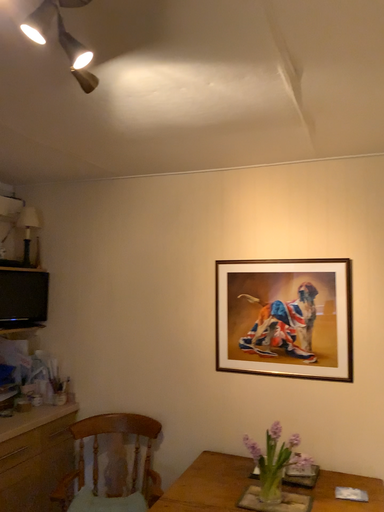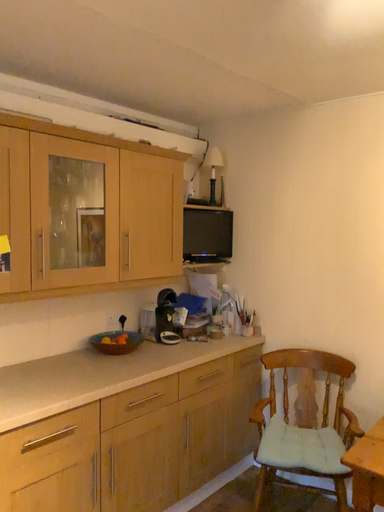
Question: Which way did the camera rotate in the video?

Choices:
 (A) rotated downward
 (B) rotated upward

Answer: (A)